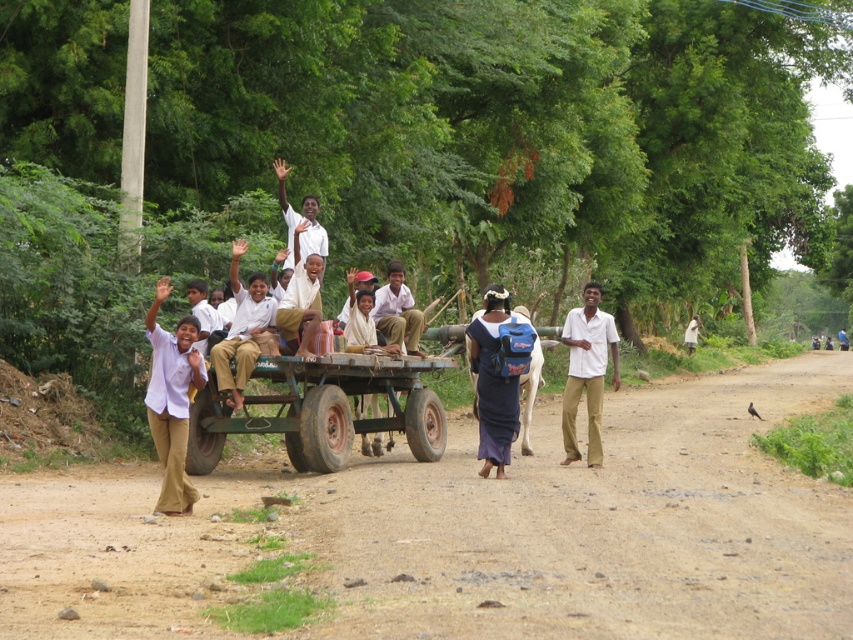
You are a photographer trying to capture a photo of the children in the cart. You want to ensure both the white cotton shirt at right and the light brown fabric dress at center are visible. Based on their positions, which child should you focus on first as you pan from left to right?

The white cotton shirt at right is to the left of the light brown fabric dress at center, so you should focus on the white cotton shirt at right first as you pan from left to right since it is positioned to the left of the light brown fabric dress at center.

You are a photographer trying to capture a photo of the blue fabric backpack at center and the white shirt at upper center. Which object should you focus on first if you want to ensure both are in focus without adjusting the camera settings?

The blue fabric backpack at center is shorter than the white shirt at upper center, so you should focus on the white shirt at upper center first to ensure both are in focus.

You are a photographer trying to capture the children in the matte white shirt at left and the matte white shirt at center. Which child should you focus on to get a clearer image if you want to avoid blurriness caused by motion?

The matte white shirt at left is thinner than the matte white shirt at center, so focusing on the matte white shirt at left would be better to avoid blurriness since thinner objects may appear sharper in motion shots.